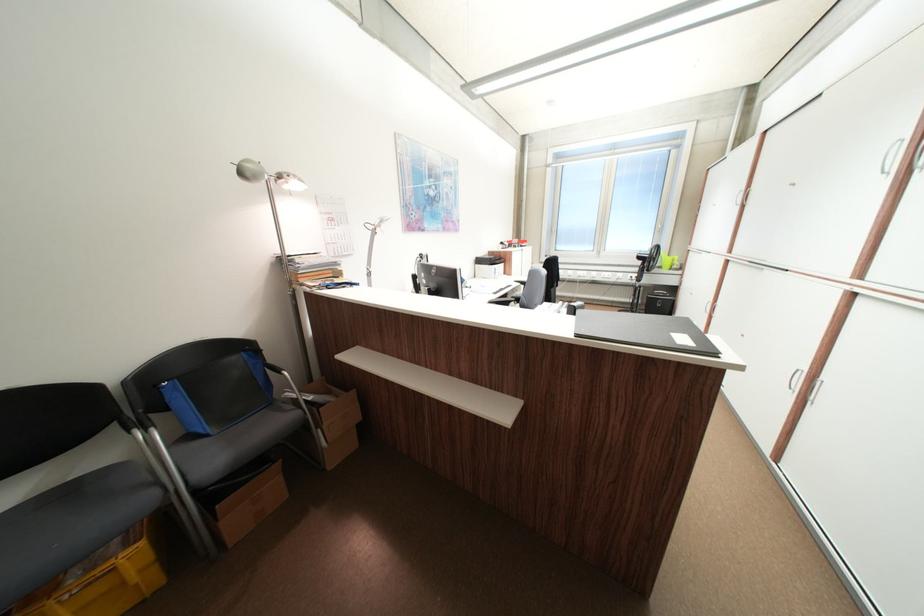
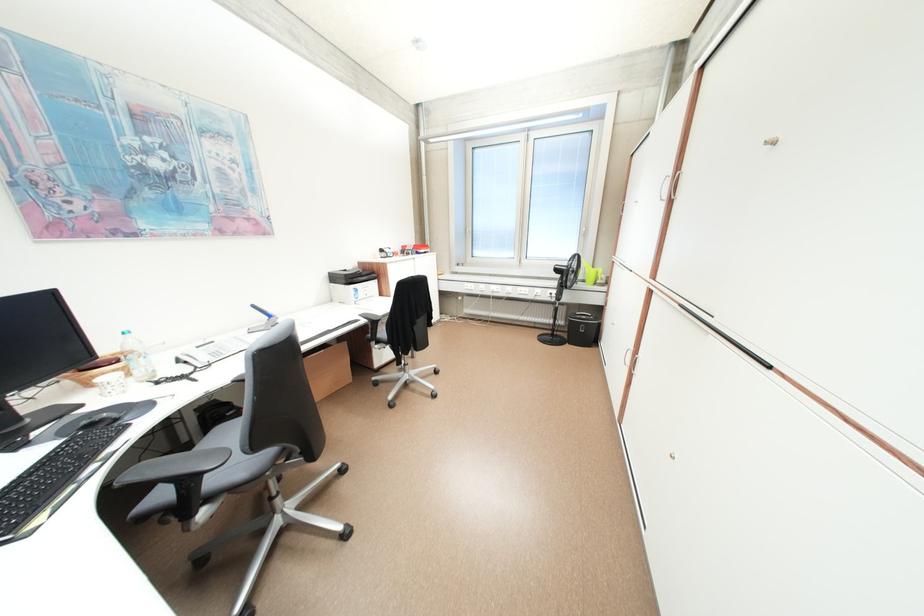
Locate, in the second image, the point that corresponds to point (754, 188) in the first image.

(679, 172)